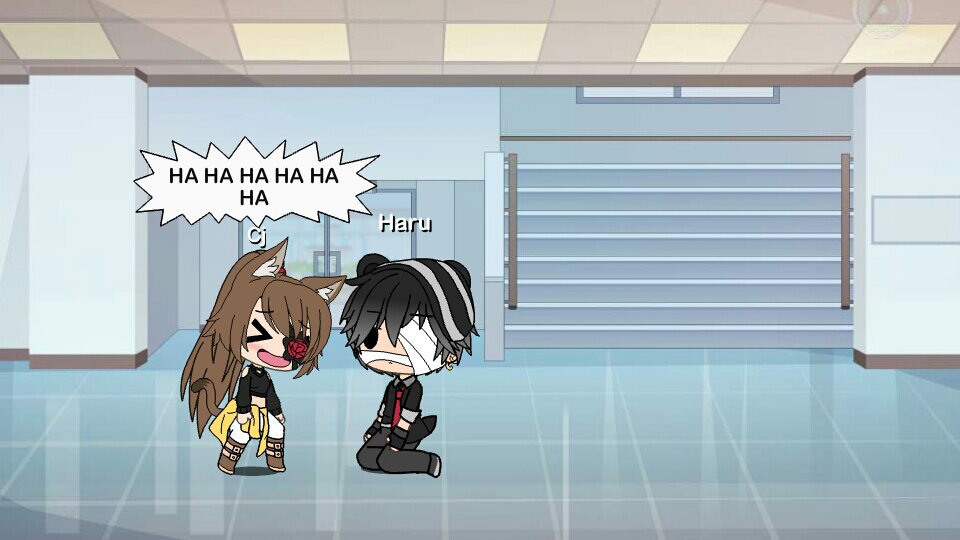
The height and width of the screenshot is (540, 960). Identify the location of window. (635, 92).